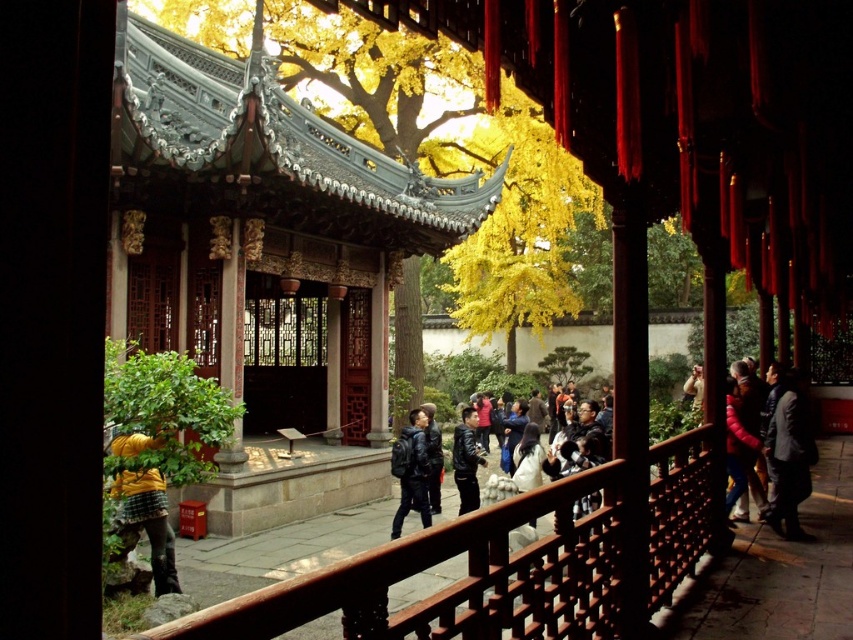
Question: Which point is closer to the camera?

Choices:
 (A) (123, 518)
 (B) (512, 292)
 (C) (410, 428)

Answer: (A)

Question: Is yellow matte jacket at lower left smaller than leather jacket at center?

Choices:
 (A) no
 (B) yes

Answer: (B)

Question: In this image, where is yellow leafy tree at center located relative to black leather jacket at center?

Choices:
 (A) above
 (B) below

Answer: (A)

Question: From the image, what is the correct spatial relationship of yellow leafy tree at center in relation to yellow matte jacket at lower left?

Choices:
 (A) right
 (B) left

Answer: (A)

Question: Which point appears closest to the camera in this image?

Choices:
 (A) (474, 593)
 (B) (369, 33)
 (C) (135, 472)
 (D) (799, 452)

Answer: (A)

Question: Which point appears closest to the camera in this image?

Choices:
 (A) (421, 465)
 (B) (331, 74)
 (C) (425, 412)
 (D) (648, 513)

Answer: (D)